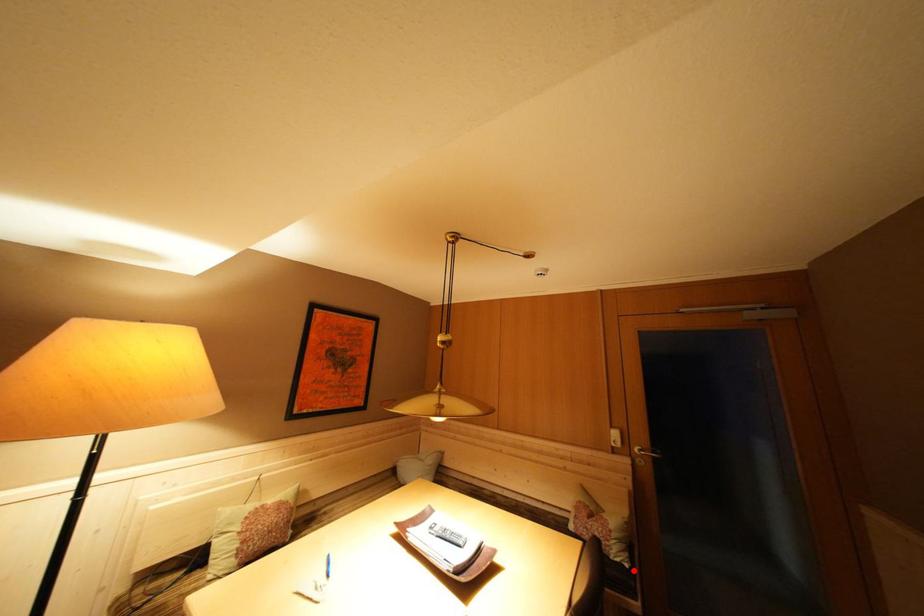
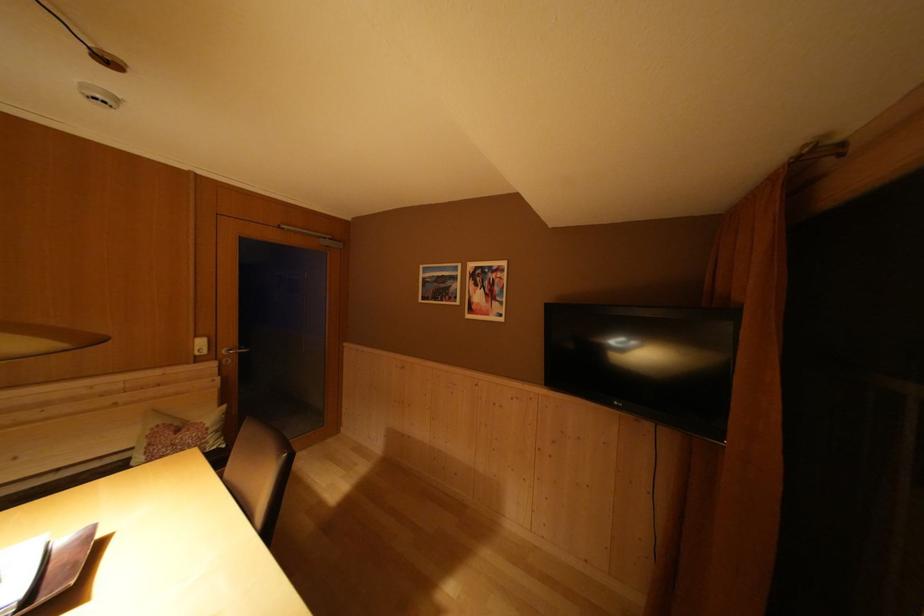
Question: I am providing you with two images of the same scene from different viewpoints. Image1 has a red point marked. In image2, the corresponding 3D location appears at what relative position? Reply with the corresponding letter.

Choices:
 (A) Closer
 (B) Farther

Answer: (B)